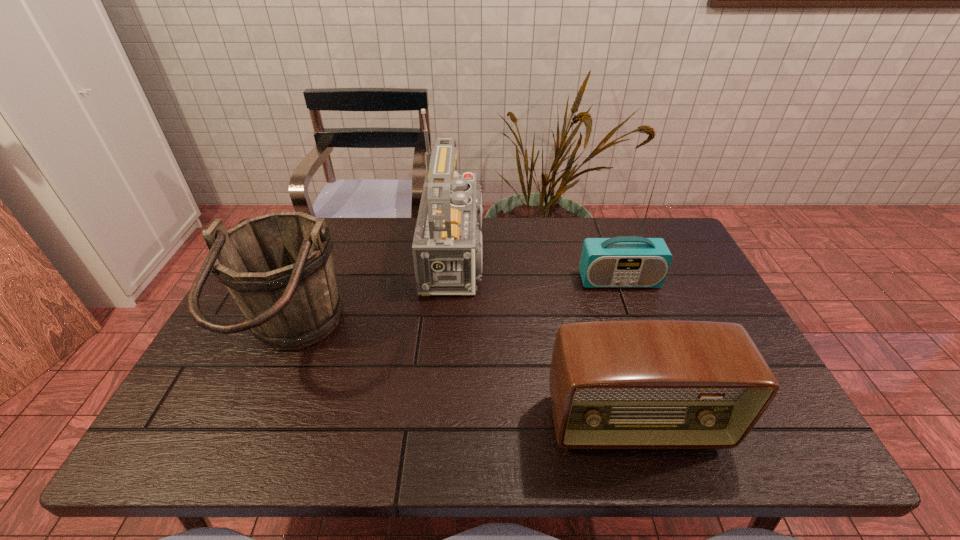
Locate an element on the screen. The height and width of the screenshot is (540, 960). object present at the left edge is located at coordinates (278, 267).

Find the location of a particular element. This screenshot has width=960, height=540. object present at the near right corner is located at coordinates (636, 384).

I want to click on vacant position at the far edge of the desktop, so [494, 233].

You are a GUI agent. You are given a task and a screenshot of the screen. Output one action in this format:
    pyautogui.click(x=<x>, y=<y>)
    Task: Click on the free region at the left edge of the desktop
    
    Given the screenshot: What is the action you would take?
    pyautogui.click(x=227, y=369)

This screenshot has height=540, width=960. Find the location of `free space at the far right corner of the desktop`. free space at the far right corner of the desktop is located at coordinates pos(663,218).

In order to click on empty location between the shortest radio receiver and the leftmost radio receiver in this screenshot , I will do `click(549, 339)`.

Locate an element on the screen. This screenshot has height=540, width=960. vacant point located between the leftmost radio receiver and the shortest radio receiver is located at coordinates (549, 339).

Where is `unoccupied area between the second tallest radio receiver and the second object from left to right`? unoccupied area between the second tallest radio receiver and the second object from left to right is located at coordinates (541, 267).

Find the location of a particular element. The image size is (960, 540). empty location between the second shortest radio receiver and the leftmost object is located at coordinates (455, 309).

Locate an element on the screen. empty location between the leftmost object and the nearest radio receiver is located at coordinates (464, 381).